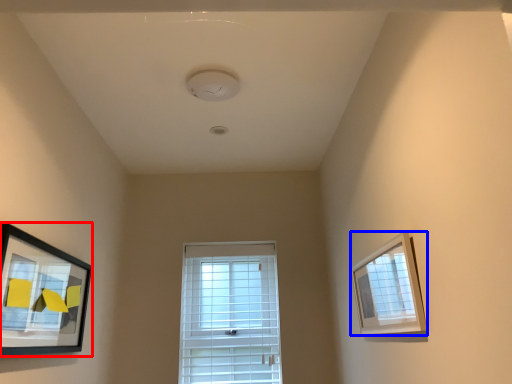
Question: Which object appears farthest to the camera in this image, picture frame (highlighted by a red box) or picture frame (highlighted by a blue box)?

Choices:
 (A) picture frame
 (B) picture frame

Answer: (B)